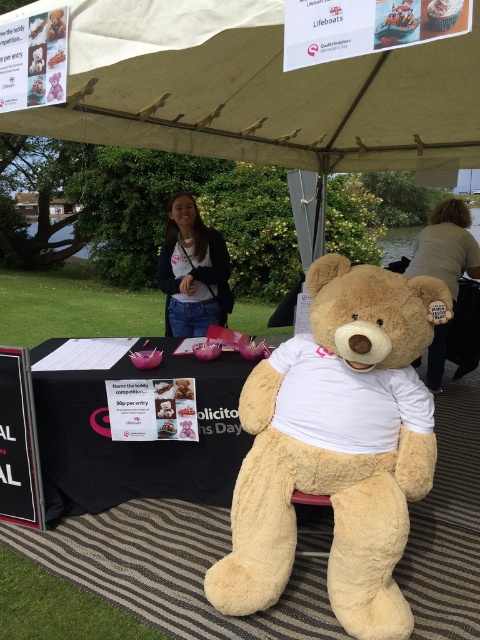
You are standing at the center of the image and see the point marked at coordinates (192, 272). What object is located exactly at that point?

The point at coordinates (192, 272) indicates the matte white shirt at center.

Based on the photo, you are organizing a childrens party and want to ensure the fluffy beige teddy bear at center and the matte white shirt at center are visible to all guests. Since the teddy bear is bigger, where should you place the smaller item to ensure both are easily seen?

Since the fluffy beige teddy bear at center is bigger than the matte white shirt at center, place the smaller matte white shirt at center in a higher position so it is visible over the teddy bear.

You are a photographer trying to capture a photo of the fluffy beige teddy bear at center and the matte white shirt at center. Which object should you focus on first if you want to ensure both are in focus without moving the camera?

The fluffy beige teddy bear at center is located below the matte white shirt at center. Since they are at different heights, focusing on the matte white shirt at center first would allow the teddy bear at center to be within the depth of field if the camera is set appropriately.